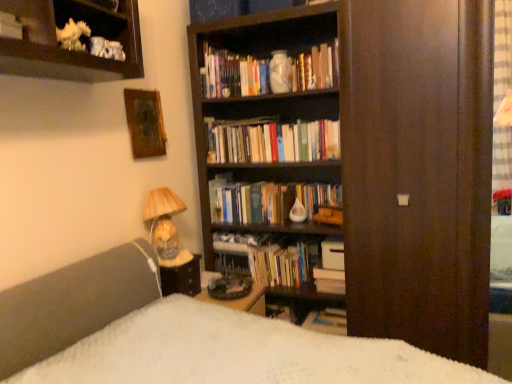
Identify the location of vacant area on top of matte brown table at lower left (from a real-world perspective). Image resolution: width=512 pixels, height=384 pixels. (174, 259).